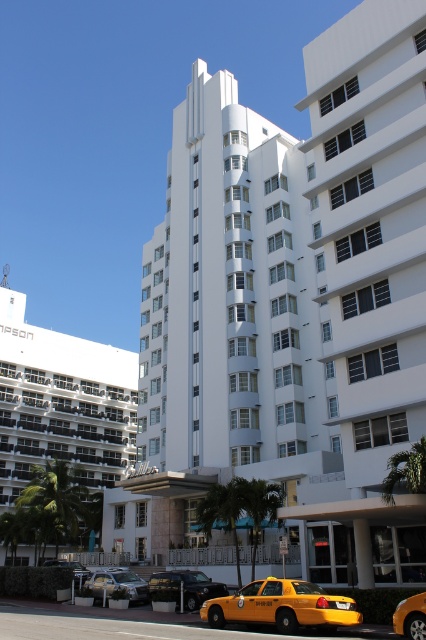
You are a photographer trying to capture the white matte building at left and the yellow matte taxi at lower center in a single frame. Given that the building is much bigger than the taxi, how might you position the camera to emphasize the size difference between them?

To emphasize the size difference between the white matte building at left and the yellow matte taxi at lower center, position the camera closer to the yellow matte taxi at lower center. This will make the taxi appear larger in the frame relative to the distant building, visually highlighting their size contrast.

You are standing at the entrance of the white matte building at left. Which direction should you face to see the building at its full height?

Since the white matte building at left is located at point 0.630 on the x and 0.146 on the y coordinate, you should face towards the left side to view the building at its full height.

You are a photographer standing in front of the white matte building at left and the yellow matte taxi at lower center. You want to capture a photo where the building is visible above the taxi. Is this possible given their current positions?

The white matte building at left is below the yellow matte taxi at lower center, so it would not be possible to capture a photo where the building is visible above the taxi in their current positions.